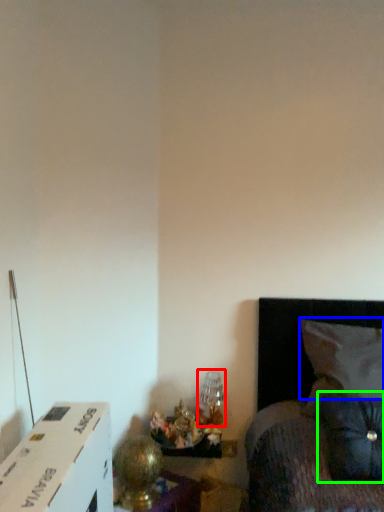
Question: Which object is the farthest from table lamp (highlighted by a red box)? Choose among these: pillow (highlighted by a blue box) or pillow (highlighted by a green box).

Choices:
 (A) pillow
 (B) pillow

Answer: (B)